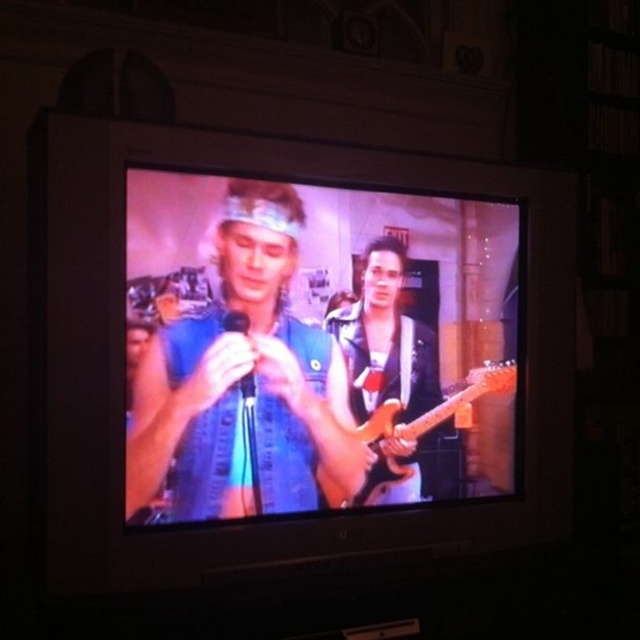
Who is more forward, (x=400, y=483) or (x=388, y=413)?

Point (x=388, y=413) is more forward.

From the picture: Can you confirm if shiny black guitar at center is taller than glossy wood guitar at center?

Indeed, shiny black guitar at center has a greater height compared to glossy wood guitar at center.

Image resolution: width=640 pixels, height=640 pixels. Find the location of `shiny black guitar at center`. shiny black guitar at center is located at coordinates (385, 339).

Find the location of a particular element. shiny black guitar at center is located at coordinates (385, 339).

Does blue denim vest at center have a greater height compared to glossy wood guitar at center?

Indeed, blue denim vest at center has a greater height compared to glossy wood guitar at center.

Does point (189, 488) come behind point (500, 368)?

No, it is not.

Describe the element at coordinates (244, 387) in the screenshot. I see `blue denim vest at center` at that location.

I want to click on blue denim vest at center, so click(244, 387).

Does blue denim vest at center appear on the left side of shiny black guitar at center?

Indeed, blue denim vest at center is positioned on the left side of shiny black guitar at center.

Does blue denim vest at center have a greater width compared to shiny black guitar at center?

Correct, the width of blue denim vest at center exceeds that of shiny black guitar at center.

Between point (205, 458) and point (352, 349), which one is positioned behind?

The point (352, 349) is more distant.

The width and height of the screenshot is (640, 640). I want to click on blue denim vest at center, so click(244, 387).